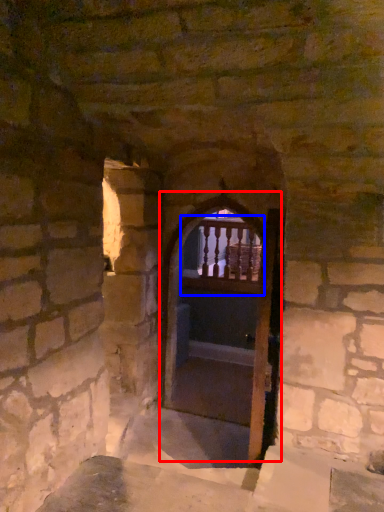
Question: Which object appears farthest to the camera in this image, door (highlighted by a red box) or balcony (highlighted by a blue box)?

Choices:
 (A) door
 (B) balcony

Answer: (B)